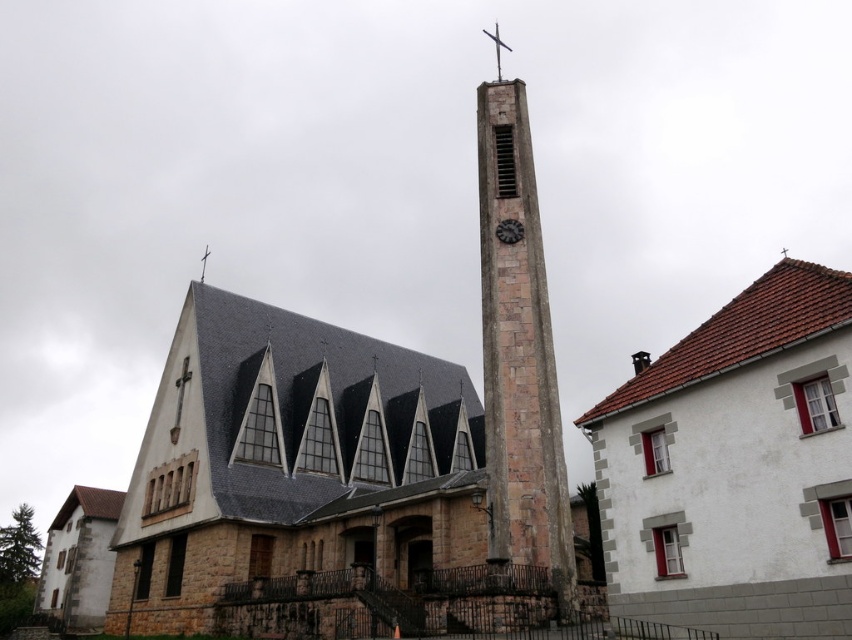
Question: Does rustic stone clock tower at center have a larger size compared to dark brown textured clock at center?

Choices:
 (A) no
 (B) yes

Answer: (B)

Question: Which of the following is the closest to the observer?

Choices:
 (A) (491, 417)
 (B) (499, 70)

Answer: (A)

Question: Based on their relative distances, which object is nearer to the dark brown textured clock at center?

Choices:
 (A) rustic stone clock tower at center
 (B) rustic stone spire at center
 (C) white stone house at right

Answer: (A)

Question: In this image, where is white stone house at right located relative to rustic stone spire at center?

Choices:
 (A) right
 (B) left

Answer: (A)

Question: Which is farther from the dark brown textured clock at center?

Choices:
 (A) white stone house at right
 (B) rustic stone clock tower at center

Answer: (A)

Question: Is dark brown textured clock at center further to the viewer compared to rustic stone spire at center?

Choices:
 (A) yes
 (B) no

Answer: (B)